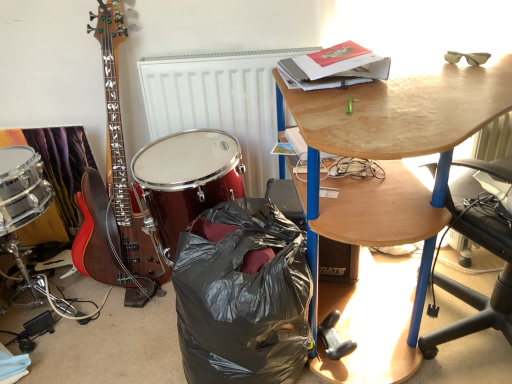
Where is `vacant area located to the right-hand side of black plastic loudspeaker at lower center`? Image resolution: width=512 pixels, height=384 pixels. vacant area located to the right-hand side of black plastic loudspeaker at lower center is located at coordinates (386, 276).